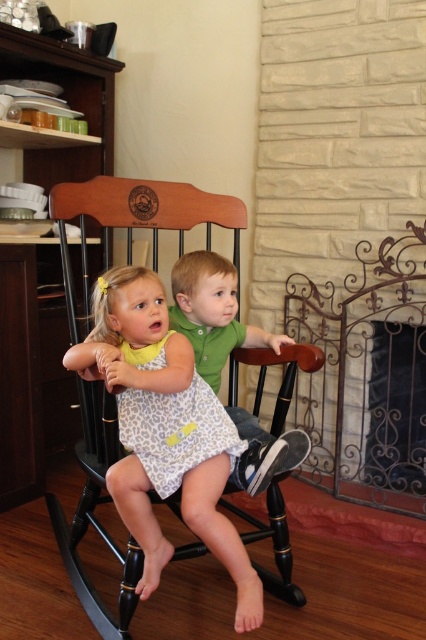
Consider the image. Can you confirm if iron wrought at right is bigger than green matte shirt at center?

Indeed, iron wrought at right has a larger size compared to green matte shirt at center.

The image size is (426, 640). Find the location of `iron wrought at right`. iron wrought at right is located at coordinates (367, 376).

This screenshot has height=640, width=426. What do you see at coordinates (164, 429) in the screenshot?
I see `leopard print dress at center` at bounding box center [164, 429].

Locate an element on the screen. leopard print dress at center is located at coordinates (164, 429).

Is point (391, 364) closer to camera compared to point (207, 410)?

No, it is not.

How far apart are iron wrought at right and leopard print dress at center?

iron wrought at right is 37.35 inches away from leopard print dress at center.

Identify the location of iron wrought at right. The height and width of the screenshot is (640, 426). (367, 376).

Identify the location of iron wrought at right. The image size is (426, 640). (367, 376).